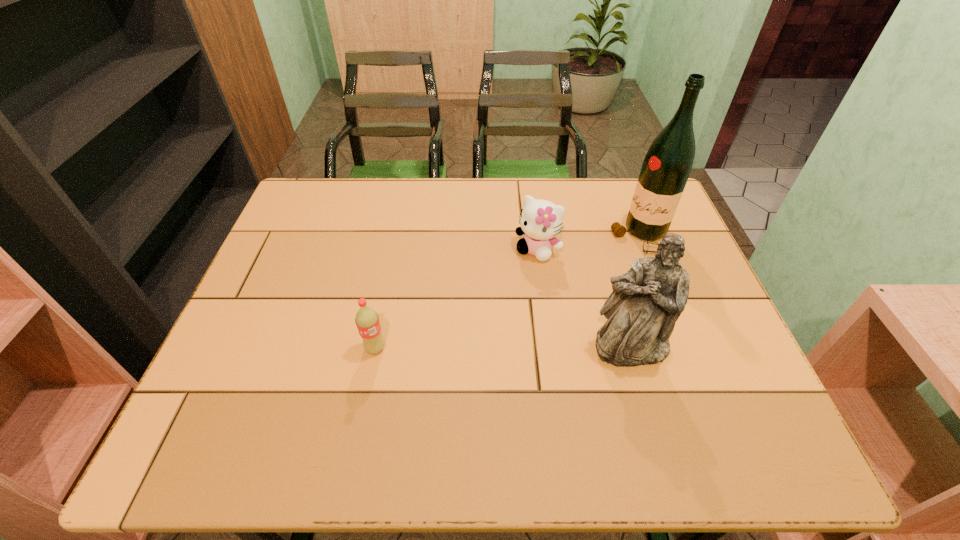
Locate which object ranks second in proximity to the soda. Please provide its 2D coordinates. Your answer should be formatted as a tuple, i.e. [(x, y)], where the tuple contains the x and y coordinates of a point satisfying the conditions above.

[(647, 300)]

Identify which object is located as the third nearest to the tallest object. Please provide its 2D coordinates. Your answer should be formatted as a tuple, i.e. [(x, y)], where the tuple contains the x and y coordinates of a point satisfying the conditions above.

[(367, 321)]

The height and width of the screenshot is (540, 960). Find the location of `vacant space that satisfies the following two spatial constraints: 1. on the back side of the leftmost object; 2. on the left side of the kitten`. vacant space that satisfies the following two spatial constraints: 1. on the back side of the leftmost object; 2. on the left side of the kitten is located at coordinates (395, 249).